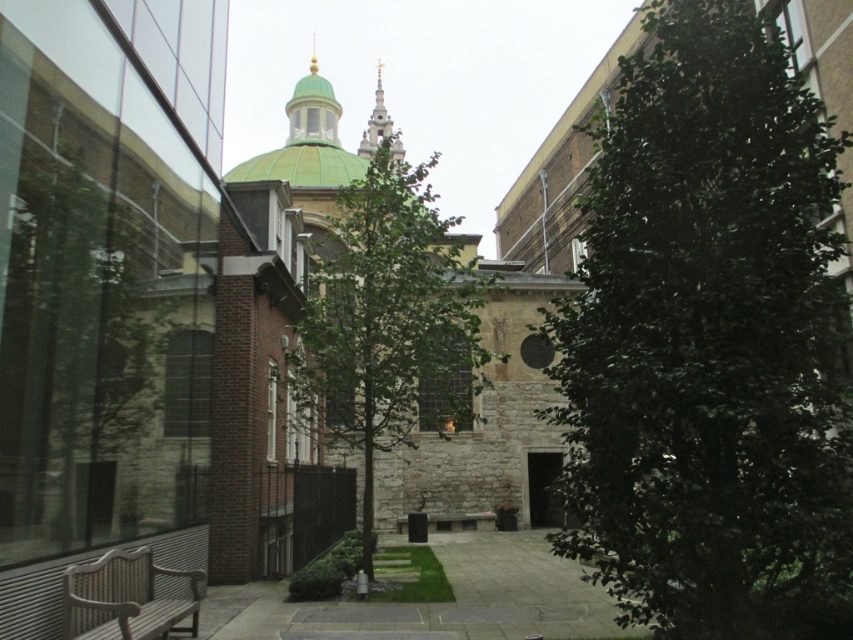
Who is taller, green leafy tree at right or green leafy tree at center?

With more height is green leafy tree at center.

Where is `green leafy tree at right`? The image size is (853, 640). green leafy tree at right is located at coordinates (711, 342).

Does wooden bench at lower left come behind green dome at upper center?

No.

Is point (137, 621) positioned in front of point (309, 76)?

That is True.

Describe the element at coordinates (125, 598) in the screenshot. I see `wooden bench at lower left` at that location.

Where is `wooden bench at lower left`? wooden bench at lower left is located at coordinates (125, 598).

Who is more forward, (511, 278) or (119, 600)?

Point (119, 600) is in front.

This screenshot has height=640, width=853. Describe the element at coordinates (461, 387) in the screenshot. I see `green stone church at center` at that location.

Is point (392, 490) positioned in front of point (83, 632)?

No, (392, 490) is further to viewer.

At what (x,y) coordinates should I click in order to perform the action: click on green stone church at center. Please return your answer as a coordinate pair (x, y). The height and width of the screenshot is (640, 853). Looking at the image, I should click on (461, 387).